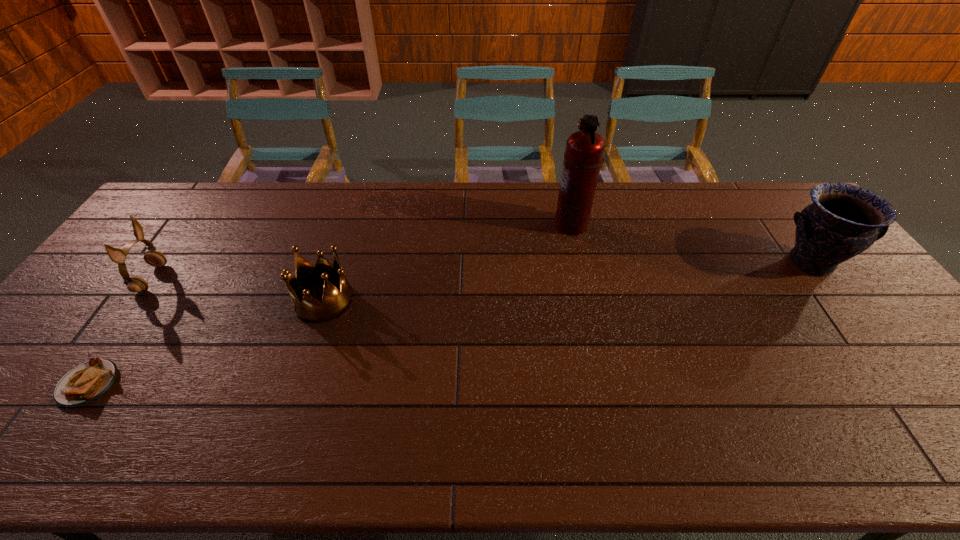
Locate an element on the screen. The width and height of the screenshot is (960, 540). the tallest object is located at coordinates (583, 156).

Image resolution: width=960 pixels, height=540 pixels. What are the coordinates of `the farthest object` in the screenshot? It's located at (583, 156).

The width and height of the screenshot is (960, 540). Find the location of `the rightmost object`. the rightmost object is located at coordinates (844, 220).

At what (x,y) coordinates should I click in order to perform the action: click on pottery. Please return your answer as a coordinate pair (x, y). The width and height of the screenshot is (960, 540). Looking at the image, I should click on (844, 220).

Where is `the third shortest object`? This screenshot has height=540, width=960. the third shortest object is located at coordinates (135, 284).

Find the location of a particular element. Image resolution: width=960 pixels, height=540 pixels. the second shortest object is located at coordinates (334, 303).

Locate an element on the screen. The width and height of the screenshot is (960, 540). crown is located at coordinates (334, 303).

This screenshot has height=540, width=960. Identify the location of sandwich. (87, 382).

You are a GUI agent. You are given a task and a screenshot of the screen. Output one action in this format:
    pyautogui.click(x=<x>, y=<y>)
    Task: Click on the shortest object
    This screenshot has height=540, width=960.
    Given the screenshot: What is the action you would take?
    pyautogui.click(x=87, y=382)

Where is `vacant area situated 0.080m on the nozzle side of the fourth object from left to right`? Image resolution: width=960 pixels, height=540 pixels. vacant area situated 0.080m on the nozzle side of the fourth object from left to right is located at coordinates (530, 225).